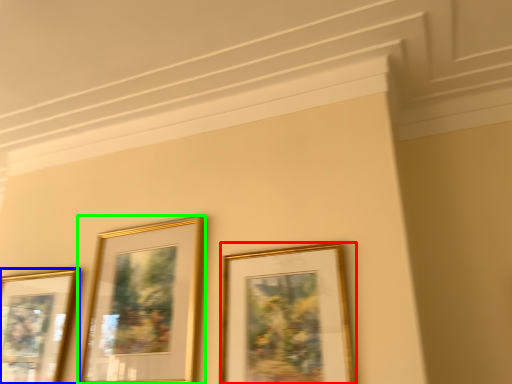
Question: Which is farther away from picture frame (highlighted by a red box)? picture frame (highlighted by a blue box) or picture frame (highlighted by a green box)?

Choices:
 (A) picture frame
 (B) picture frame

Answer: (A)